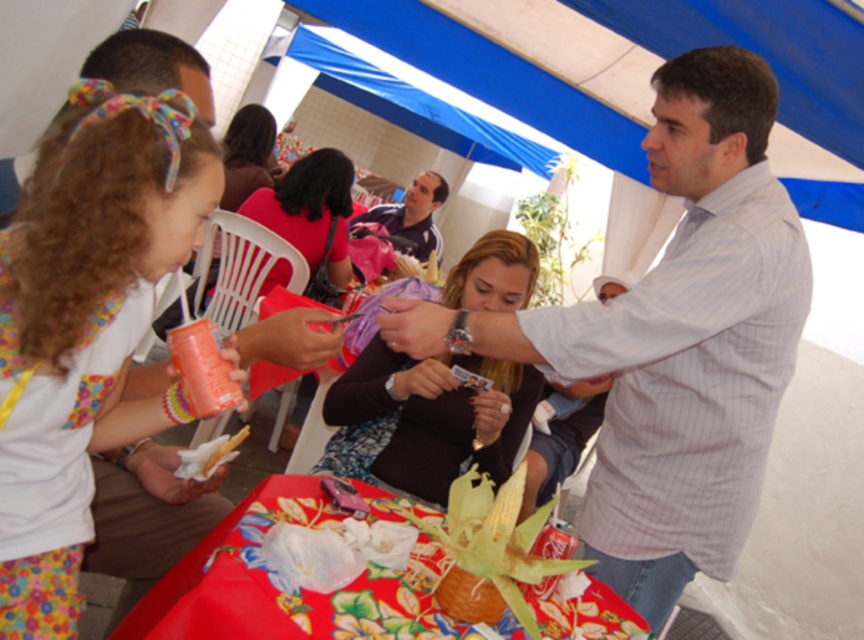
You are standing at the center of the image. Which direction should you move to find the floral fabric dress at left?

The floral fabric dress at left is located at the left side of the image, so you should move to the left to find it.

You are standing at the point with coordinates (674, 340) in the image. What object are you touching?

You are touching the white striped shirt at center.

You are at a gathering under a blue and white striped canopy tent. You see a man in a light colored striped shirt and a young girl wearing a colorful headband and a white top with floral patterns. There is also a point marked at coordinates (86, 326). What is the position of the floral fabric dress relative to the young girl?

The point at (86, 326) marks the floral fabric dress at left, so the floral fabric dress is to the left of the young girl.